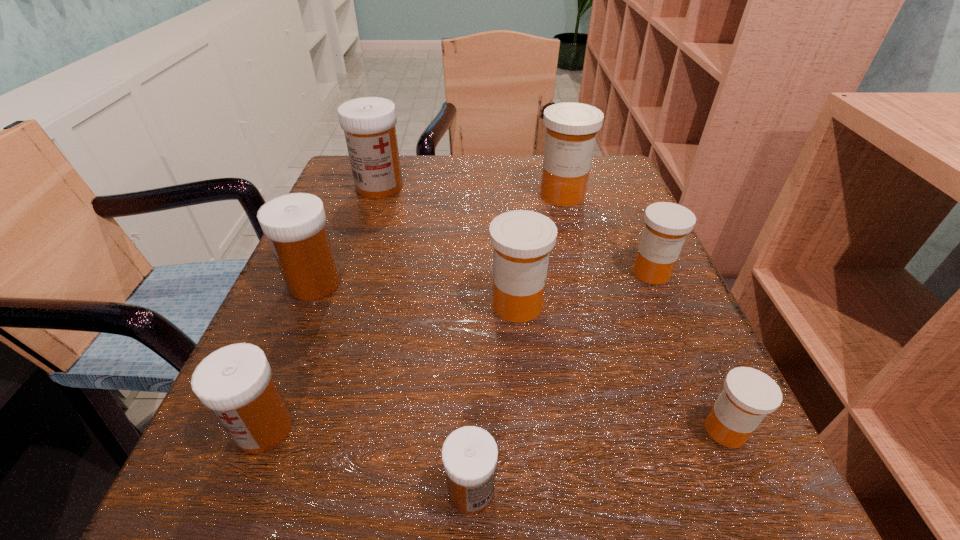
Where is `vacant area that lies between the rightmost white medicine and the biggest white medicine`? vacant area that lies between the rightmost white medicine and the biggest white medicine is located at coordinates (425, 339).

Locate an element on the screen. The height and width of the screenshot is (540, 960). unoccupied area between the second biggest orange medicine and the farthest white medicine is located at coordinates (448, 246).

Locate which object ranks second in proximity to the nearest orange medicine. Please provide its 2D coordinates. Your answer should be formatted as a tuple, i.e. [(x, y)], where the tuple contains the x and y coordinates of a point satisfying the conditions above.

[(667, 224)]

The height and width of the screenshot is (540, 960). In order to click on object that stands as the second closest to the smallest orange medicine in this screenshot , I will do `click(667, 224)`.

Identify which medicine is the third closest to the second smallest orange medicine. Please provide its 2D coordinates. Your answer should be formatted as a tuple, i.e. [(x, y)], where the tuple contains the x and y coordinates of a point satisfying the conditions above.

[(749, 395)]

Point out which medicine is positioned as the second nearest to the third biggest orange medicine. Please provide its 2D coordinates. Your answer should be formatted as a tuple, i.e. [(x, y)], where the tuple contains the x and y coordinates of a point satisfying the conditions above.

[(571, 131)]

Choose which white medicine is the third nearest neighbor to the biggest white medicine. Please provide its 2D coordinates. Your answer should be formatted as a tuple, i.e. [(x, y)], where the tuple contains the x and y coordinates of a point satisfying the conditions above.

[(469, 454)]

Select which white medicine is the third closest to the second smallest orange medicine. Please provide its 2D coordinates. Your answer should be formatted as a tuple, i.e. [(x, y)], where the tuple contains the x and y coordinates of a point satisfying the conditions above.

[(295, 224)]

Find the location of a particular element. This screenshot has width=960, height=540. orange medicine that can be found as the third closest to the third smallest orange medicine is located at coordinates (571, 131).

Identify the location of orange medicine object that ranks as the fourth closest to the nearest medicine. (571, 131).